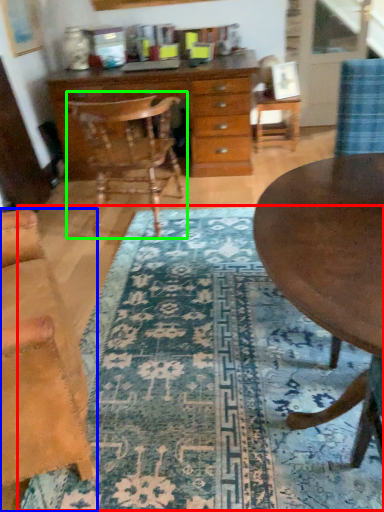
Question: Which object is positioned closest to mat (highlighted by a red box)? Select from chair (highlighted by a blue box) and chair (highlighted by a green box).

Choices:
 (A) chair
 (B) chair

Answer: (A)